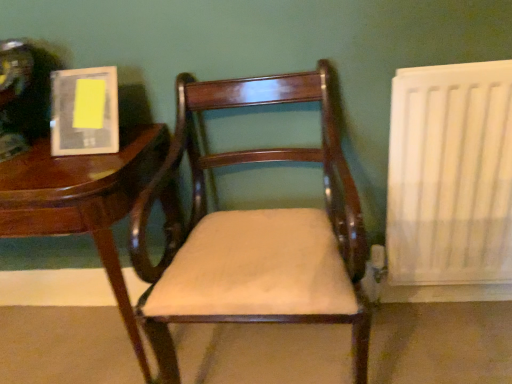
Question: From the image's perspective, would you say wooden table at left is shown under matte plastic book at upper left?

Choices:
 (A) yes
 (B) no

Answer: (A)

Question: From a real-world perspective, does wooden table at left stand above matte plastic book at upper left?

Choices:
 (A) no
 (B) yes

Answer: (A)

Question: Does wooden table at left appear on the right side of matte plastic book at upper left?

Choices:
 (A) no
 (B) yes

Answer: (A)

Question: Could you tell me if wooden table at left is facing matte plastic book at upper left?

Choices:
 (A) no
 (B) yes

Answer: (A)

Question: From a real-world perspective, is wooden table at left located beneath matte plastic book at upper left?

Choices:
 (A) yes
 (B) no

Answer: (A)

Question: Considering the positions of point (50, 200) and point (68, 109), is point (50, 200) closer or farther from the camera than point (68, 109)?

Choices:
 (A) farther
 (B) closer

Answer: (B)

Question: In the image, is wooden table at left positioned in front of or behind matte plastic book at upper left?

Choices:
 (A) front
 (B) behind

Answer: (A)

Question: Looking at the image, does wooden table at left seem bigger or smaller compared to matte plastic book at upper left?

Choices:
 (A) small
 (B) big

Answer: (B)

Question: Considering the relative positions of wooden table at left and matte plastic book at upper left in the image provided, is wooden table at left to the left or to the right of matte plastic book at upper left?

Choices:
 (A) left
 (B) right

Answer: (A)

Question: From the image's perspective, is matte plastic book at upper left above or below matte wood chair at center?

Choices:
 (A) above
 (B) below

Answer: (A)

Question: Choose the correct answer: Is matte plastic book at upper left inside matte wood chair at center or outside it?

Choices:
 (A) inside
 (B) outside

Answer: (B)

Question: In terms of size, does matte plastic book at upper left appear bigger or smaller than matte wood chair at center?

Choices:
 (A) small
 (B) big

Answer: (A)

Question: Considering the positions of matte plastic book at upper left and matte wood chair at center in the image, is matte plastic book at upper left wider or thinner than matte wood chair at center?

Choices:
 (A) thin
 (B) wide

Answer: (A)

Question: Considering their positions, is matte plastic book at upper left located in front of or behind white matte radiator at right?

Choices:
 (A) behind
 (B) front

Answer: (A)

Question: Considering the positions of matte plastic book at upper left and white matte radiator at right in the image, is matte plastic book at upper left taller or shorter than white matte radiator at right?

Choices:
 (A) tall
 (B) short

Answer: (B)